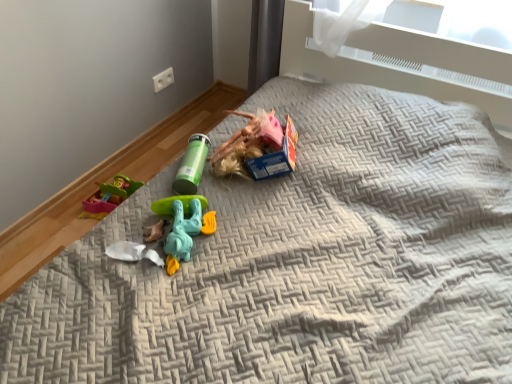
Question: From the image's perspective, is green plastic tube at center, which is counted as the third toy, starting from the front, under white plastic toy at center, acting as the second toy starting from the front?

Choices:
 (A) yes
 (B) no

Answer: (B)

Question: Are green plastic tube at center, which is the third toy in bottom-to-top order, and white plastic toy at center, acting as the second toy starting from the front, far apart?

Choices:
 (A) yes
 (B) no

Answer: (B)

Question: Is green plastic tube at center, marked as the first toy in a back-to-front arrangement, taller than white plastic toy at center, acting as the second toy starting from the front?

Choices:
 (A) yes
 (B) no

Answer: (A)

Question: Can you confirm if green plastic tube at center, marked as the first toy in a back-to-front arrangement, is smaller than white plastic toy at center, acting as the second toy starting from the front?

Choices:
 (A) yes
 (B) no

Answer: (B)

Question: Is green plastic tube at center, marked as the first toy in a back-to-front arrangement, aimed at white plastic toy at center, positioned as the 1th toy in bottom-to-top order?

Choices:
 (A) yes
 (B) no

Answer: (A)

Question: Is point (206, 211) closer or farther from the camera than point (128, 253)?

Choices:
 (A) closer
 (B) farther

Answer: (B)

Question: Considering the relative positions of teal plastic toy at center, which is the second toy from bottom to top, and white plastic toy at center, acting as the second toy starting from the front, in the image provided, is teal plastic toy at center, which is the second toy from bottom to top, to the left or to the right of white plastic toy at center, acting as the second toy starting from the front,?

Choices:
 (A) left
 (B) right

Answer: (B)

Question: From their relative heights in the image, would you say teal plastic toy at center, which is the second toy from bottom to top, is taller or shorter than white plastic toy at center, acting as the second toy starting from the front?

Choices:
 (A) tall
 (B) short

Answer: (A)

Question: In the image, is teal plastic toy at center, positioned as the 1th toy in front-to-back order, positioned in front of or behind white plastic toy at center, acting as the second toy starting from the front?

Choices:
 (A) behind
 (B) front

Answer: (B)

Question: From a real-world perspective, is white plastic toy at center, positioned as the 1th toy in bottom-to-top order, physically located above or below teal plastic toy at center, which ranks as the third toy in back-to-front order?

Choices:
 (A) above
 (B) below

Answer: (B)

Question: Is white plastic toy at center, positioned as the 1th toy in bottom-to-top order, wider or thinner than teal plastic toy at center, positioned as the 1th toy in front-to-back order?

Choices:
 (A) wide
 (B) thin

Answer: (B)

Question: In terms of size, does white plastic toy at center, marked as the 3th toy in a top-to-bottom arrangement, appear bigger or smaller than teal plastic toy at center, which is the second toy from bottom to top?

Choices:
 (A) big
 (B) small

Answer: (B)

Question: Is point (109, 253) positioned closer to the camera than point (184, 258)?

Choices:
 (A) closer
 (B) farther

Answer: (A)

Question: Choose the correct answer: Is white plastic toy at center, the second toy in the back-to-front sequence, inside green plastic tube at center, which is the third toy in bottom-to-top order, or outside it?

Choices:
 (A) outside
 (B) inside

Answer: (A)

Question: In terms of width, does white plastic toy at center, acting as the second toy starting from the front, look wider or thinner when compared to green plastic tube at center, marked as the first toy in a back-to-front arrangement?

Choices:
 (A) wide
 (B) thin

Answer: (B)